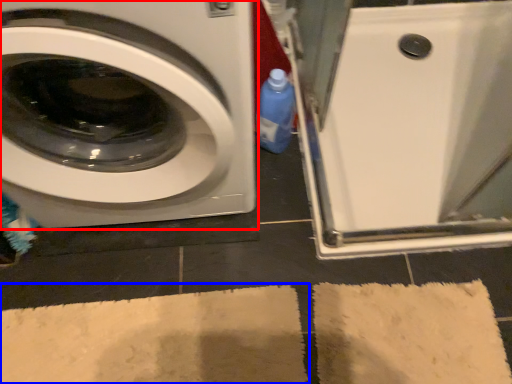
Question: Which point is closer to the camera, washing machine (highlighted by a red box) or bath mat (highlighted by a blue box)?

Choices:
 (A) washing machine
 (B) bath mat

Answer: (A)